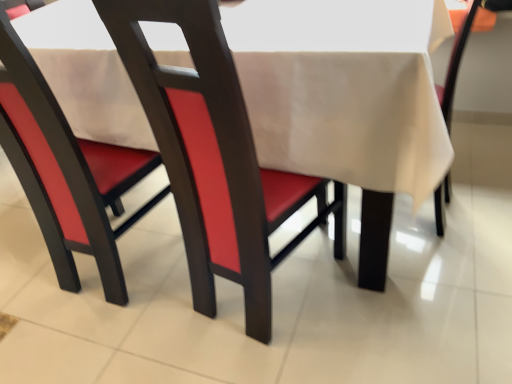
Locate an element on the screen. The width and height of the screenshot is (512, 384). empty space that is to the right of beige fabric chair at center, marked as the 1th chair in a right-to-left arrangement is located at coordinates (481, 189).